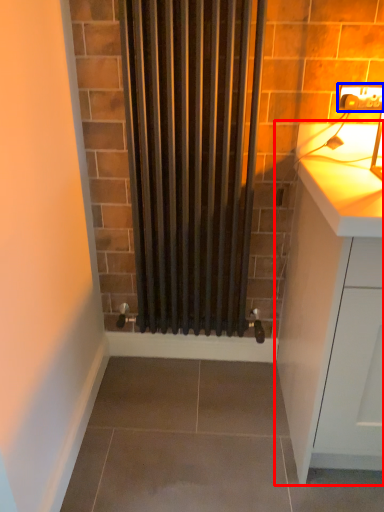
Question: Which point is closer to the camera, cabinetry (highlighted by a red box) or electric outlet (highlighted by a blue box)?

Choices:
 (A) cabinetry
 (B) electric outlet

Answer: (A)